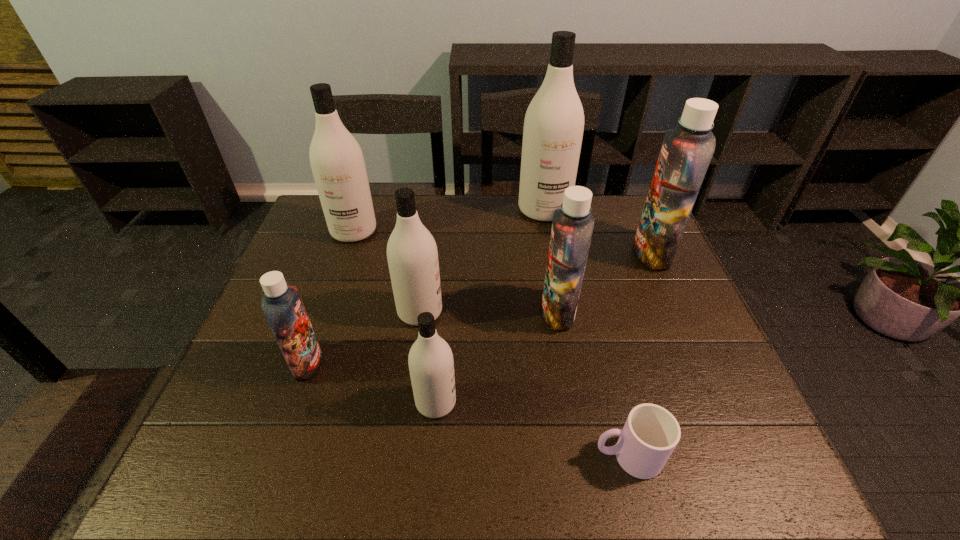
Locate an element on the screen. This screenshot has width=960, height=540. the nearest white shampoo is located at coordinates (431, 364).

At what (x,y) coordinates should I click in order to perform the action: click on cup. Please return your answer as a coordinate pair (x, y). Looking at the image, I should click on (650, 434).

Identify the location of the nearest object. (650, 434).

What are the coordinates of `vacant region located 0.090m on the front-facing side of the biggest white shampoo` in the screenshot? It's located at (550, 243).

Locate an element on the screen. vacant space located on the front label of the rightmost object is located at coordinates (500, 253).

Identify the location of free region located 0.300m on the front label of the rightmost object. This screenshot has width=960, height=540. (534, 253).

I want to click on free region located on the front label of the rightmost object, so click(554, 253).

Identify the location of free space located on the front-facing side of the leftmost white shampoo. This screenshot has width=960, height=540. (337, 279).

Identify the location of free spot located on the front label of the second nearest blue shampoo. (464, 312).

Locate an element on the screen. Image resolution: width=960 pixels, height=540 pixels. free space located 0.110m on the front label of the second nearest blue shampoo is located at coordinates (498, 312).